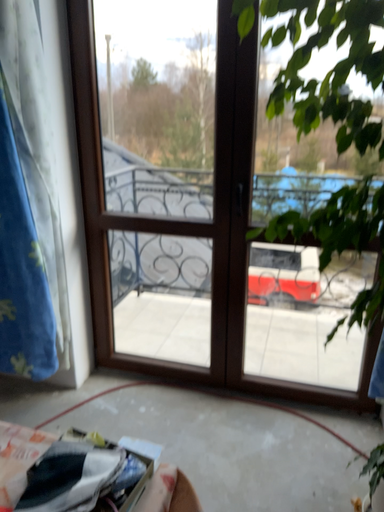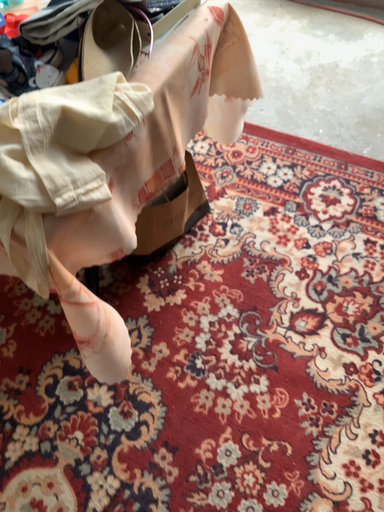
Question: Which way did the camera rotate in the video?

Choices:
 (A) rotated upward
 (B) rotated downward

Answer: (B)